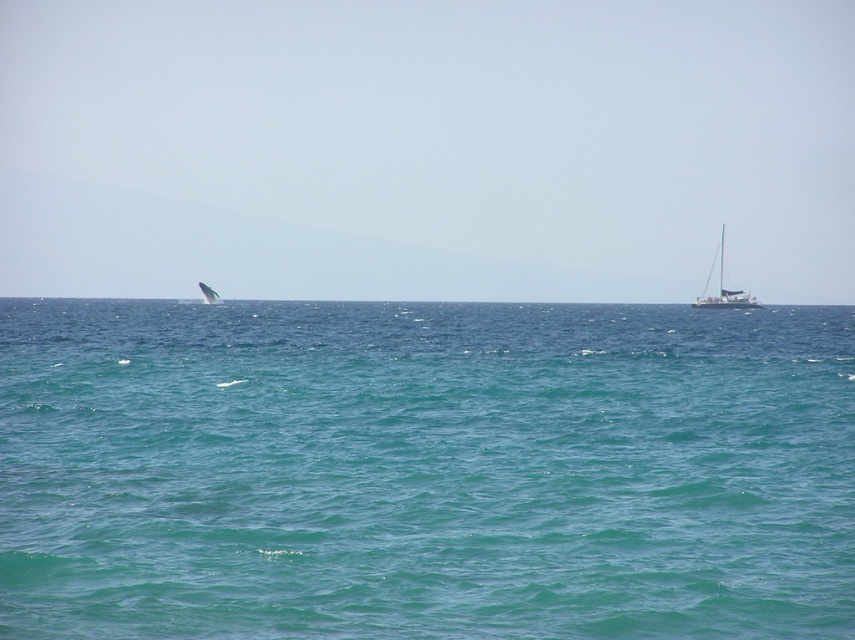
Is teal glossy water at center smaller than white matte whale at upper left?

No.

Is teal glossy water at center thinner than white matte whale at upper left?

Incorrect, teal glossy water at center's width is not less than white matte whale at upper left's.

Is point (694, 614) closer to camera compared to point (208, 298)?

Yes, it is in front of point (208, 298).

Where is `teal glossy water at center`? This screenshot has width=855, height=640. teal glossy water at center is located at coordinates (423, 470).

Between teal glossy water at center and black matte sailboat at right, which one appears on the right side from the viewer's perspective?

black matte sailboat at right

Which is more to the left, teal glossy water at center or black matte sailboat at right?

Positioned to the left is teal glossy water at center.

Which is in front, point (835, 468) or point (741, 296)?

Positioned in front is point (835, 468).

This screenshot has width=855, height=640. Find the location of `teal glossy water at center`. teal glossy water at center is located at coordinates (423, 470).

Does black matte sailboat at right lie behind white matte whale at upper left?

Yes, black matte sailboat at right is further from the viewer.

Between point (718, 253) and point (217, 301), which one is positioned behind?

The point (718, 253) is more distant.

The image size is (855, 640). I want to click on black matte sailboat at right, so pyautogui.click(x=723, y=288).